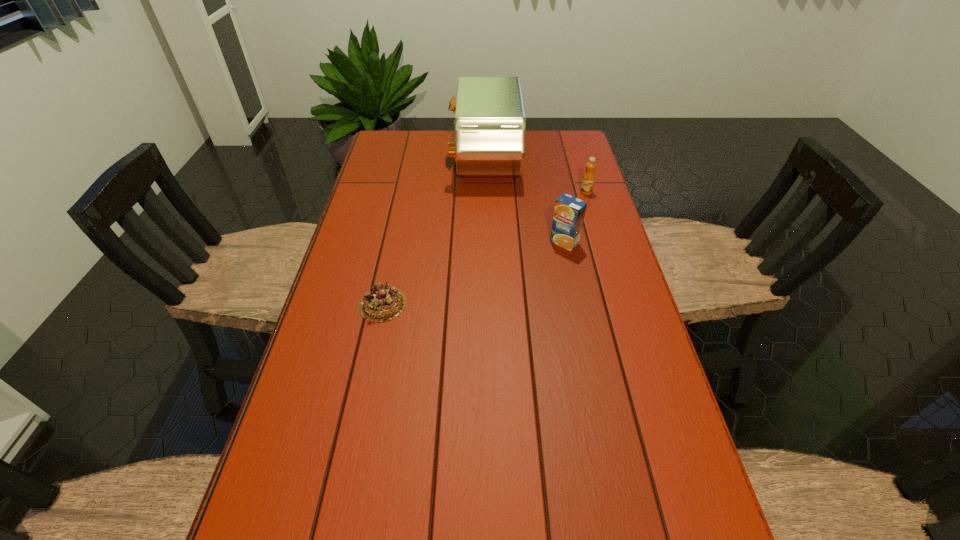
You are a GUI agent. You are given a task and a screenshot of the screen. Output one action in this format:
    pyautogui.click(x=<x>, y=<y>)
    Task: Click on the free region located 0.170m on the front label of the rightmost object
    The width and height of the screenshot is (960, 540).
    Given the screenshot: What is the action you would take?
    pyautogui.click(x=597, y=229)

This screenshot has height=540, width=960. I want to click on vacant space situated on the front of the nearest object, so click(x=366, y=386).

The height and width of the screenshot is (540, 960). I want to click on object that is at the far edge, so click(490, 123).

You are a GUI agent. You are given a task and a screenshot of the screen. Output one action in this format:
    pyautogui.click(x=<x>, y=<y>)
    Task: Click on the object that is at the left edge
    
    Given the screenshot: What is the action you would take?
    pyautogui.click(x=381, y=303)

Identify the location of free space at the left edge of the desktop. (383, 193).

Where is `free region at the right edge of the desktop`? free region at the right edge of the desktop is located at coordinates (607, 427).

This screenshot has width=960, height=540. What are the coordinates of `free spot at the far left corner of the desktop` in the screenshot? It's located at (406, 150).

In the image, there is a desktop. Find the location of `vacant region at the far right corner`. vacant region at the far right corner is located at coordinates (567, 156).

Image resolution: width=960 pixels, height=540 pixels. I want to click on vacant area that lies between the toaster oven and the second shortest object, so click(536, 176).

Locate an element on the screen. vacant point located between the second object from left to right and the shortest object is located at coordinates (434, 232).